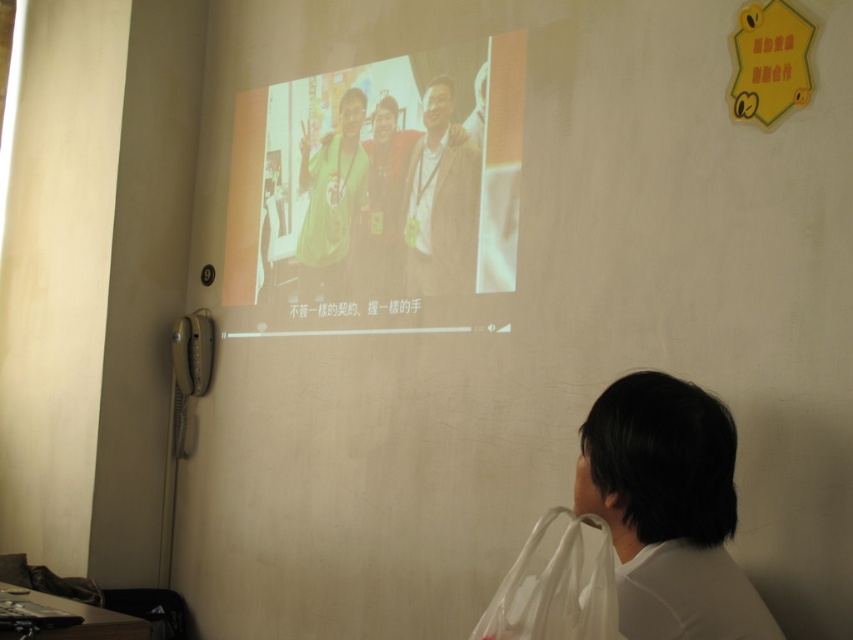
You are organizing a closet and need to decide which item takes up more space. Based on the scene, which object is bigger between the matte brown jacket at center and the white plastic bag at lower right?

The matte brown jacket at center is larger in size than the white plastic bag at lower right, so it takes up more space.

You are organizing a charity event and need to hang two items on a wall. You have a matte brown jacket at center and a green jersey at center. Based on their sizes, which item will require less vertical space to hang?

The matte brown jacket at center has a lesser height compared to the green jersey at center, so it will require less vertical space to hang.